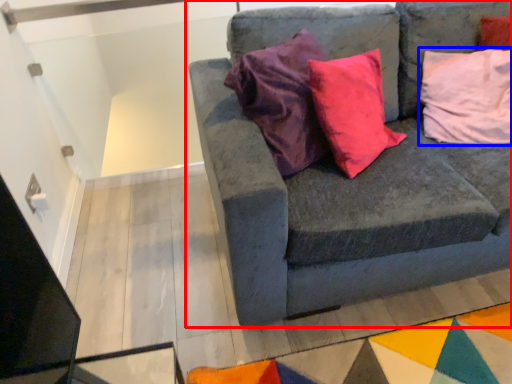
Question: Which object appears closest to the camera in this image, studio couch (highlighted by a red box) or pillow (highlighted by a blue box)?

Choices:
 (A) studio couch
 (B) pillow

Answer: (A)